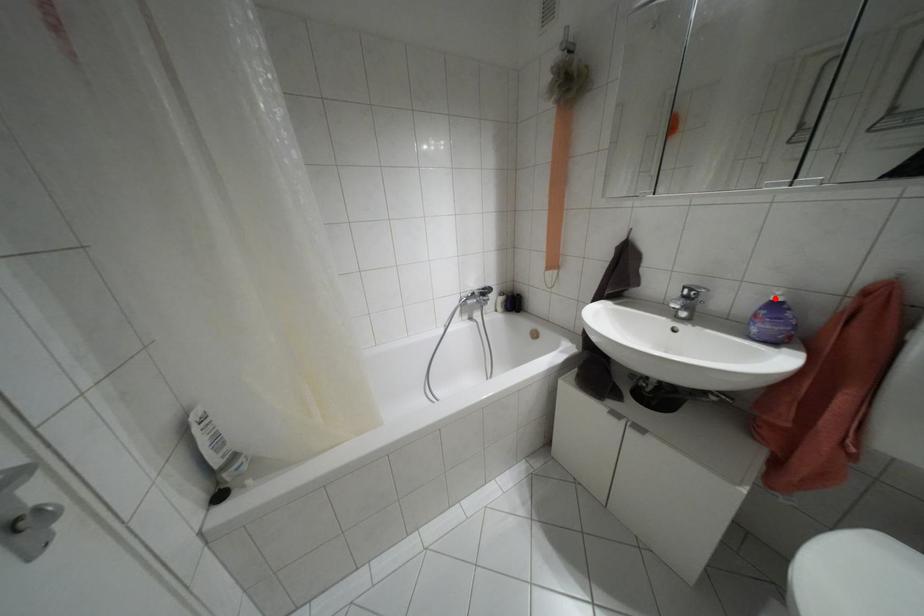
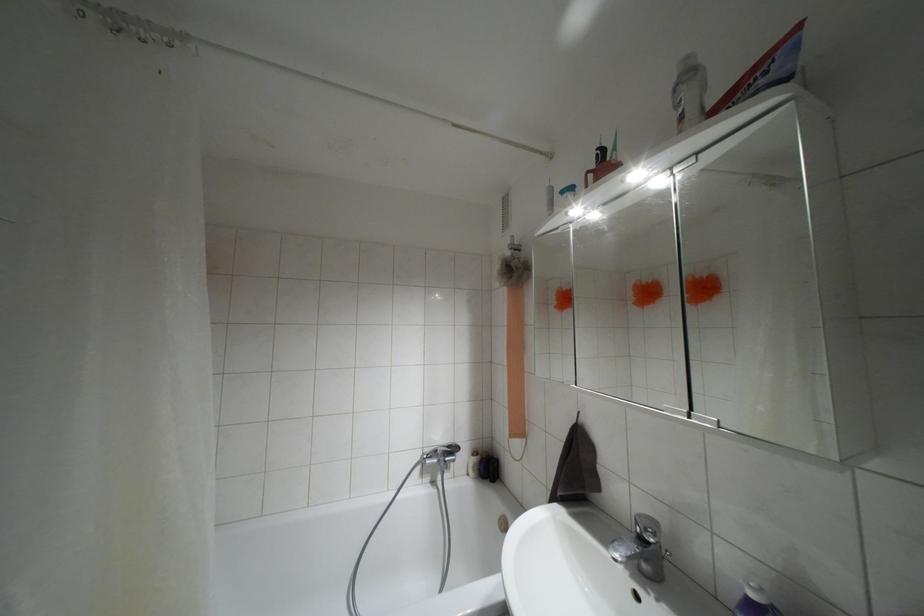
Find the pixel in the second image that matches the highlighted location in the first image.

(751, 594)